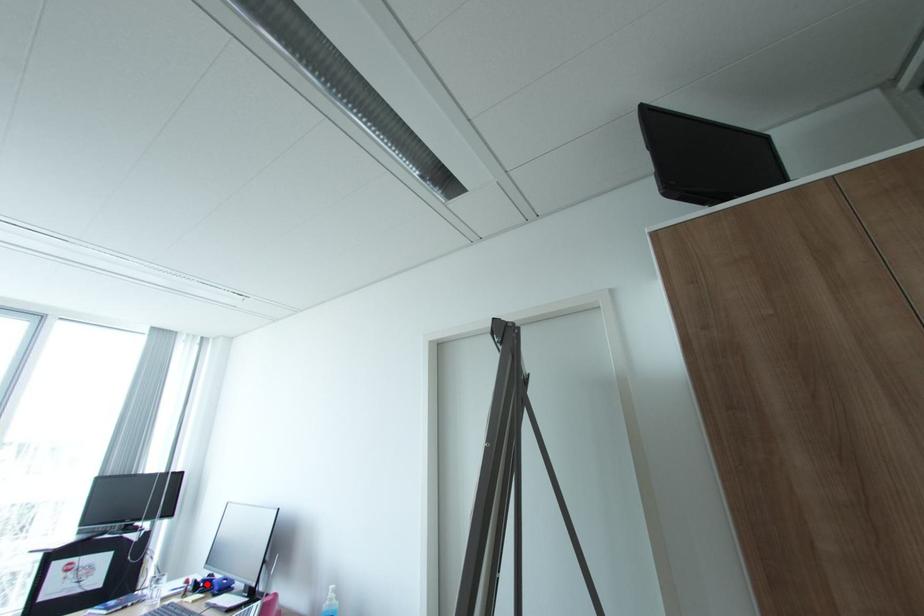
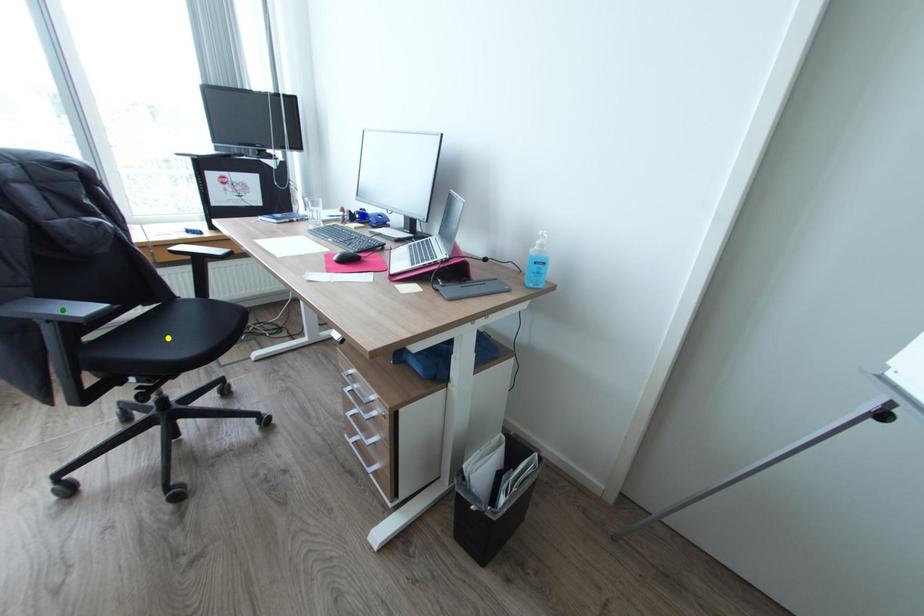
Question: I am providing you with two images of the same scene from different viewpoints. A red point is marked on the first image. You are given multiple points on the second image. In image 2, which mark is for the same physical point as the one in image 1?

Choices:
 (A) green point
 (B) blue point
 (C) yellow point

Answer: (B)